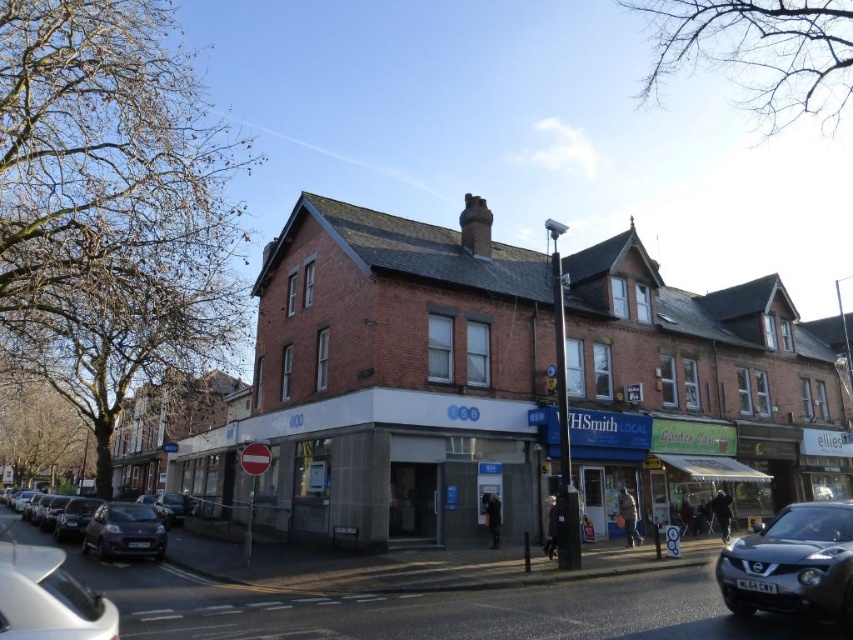
You are standing at the point with coordinates point (102, 528) and want to walk to the point with coordinates point (36, 632). Which direction should you face to move towards your destination?

You should face north because point (36, 632) is in front of point (102, 528), indicating it is north of your current position.

In the scene shown: You are a delivery person trying to park your van next to the two cars at the lower left. The van is 6 meters long. Can you fit your van between the white glossy car at lower left and the dark gray metallic car at lower left?

The white glossy car at lower left occupies less space than dark gray metallic car at lower left, so the space between them may be sufficient for your 6 meter van. However, without knowing the exact distance between the cars, it is difficult to confirm. Please check the available space carefully before attempting to park.